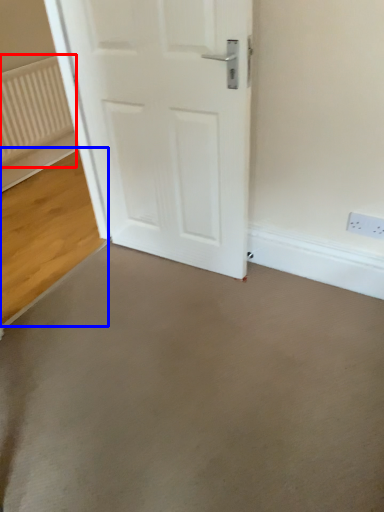
Question: Which of the following is the closest to the observer, radiator (highlighted by a red box) or concrete (highlighted by a blue box)?

Choices:
 (A) radiator
 (B) concrete

Answer: (B)